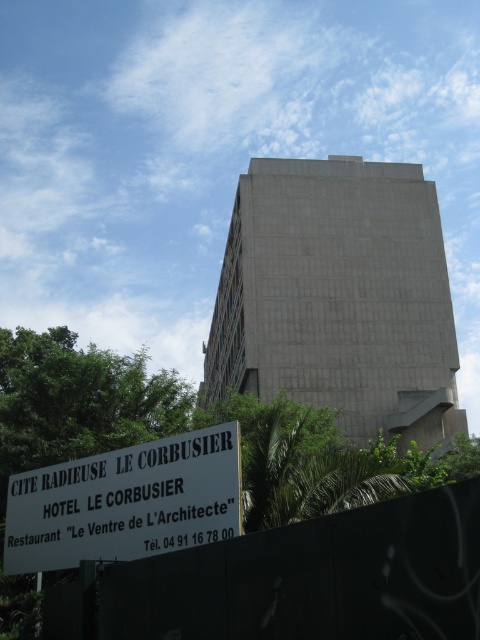
You are a visitor approaching the building and want to see the signboard clearly. Which object between the black matte fence at lower center and the white plastic sign at lower left is shorter, potentially allowing you to see past it to the signboard?

The black matte fence at lower center is shorter than the white plastic sign at lower left, so you can see past the black matte fence at lower center to the signboard.